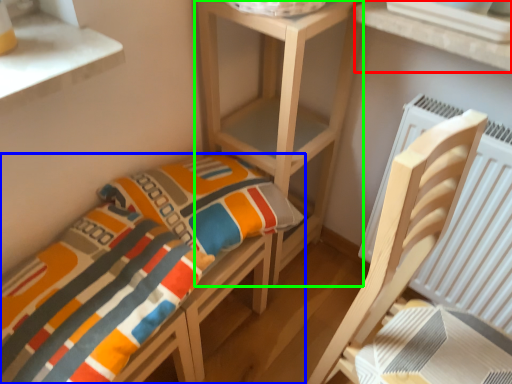
Question: Considering the real-world distances, which object is farthest from window (highlighted by a red box)? furniture (highlighted by a blue box) or shelf (highlighted by a green box)?

Choices:
 (A) furniture
 (B) shelf

Answer: (A)